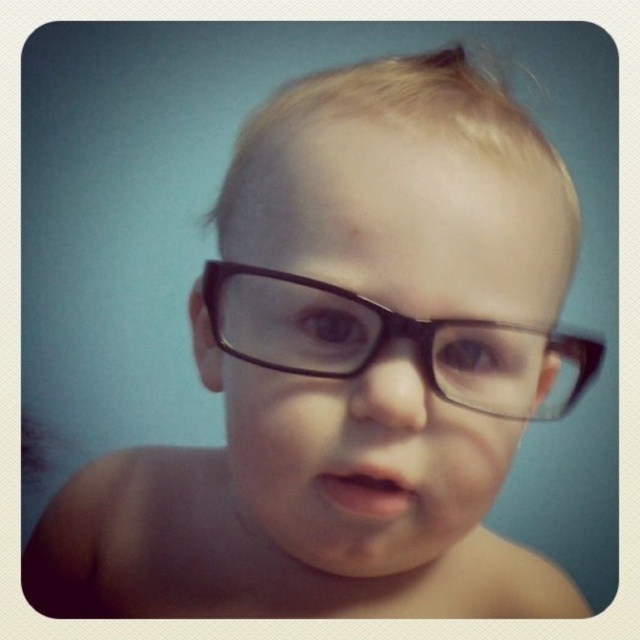
The child in the image is wearing two pairs of glasses, the black matte glasses at center and the black plastic glasses at center. Which pair is taller?

The black matte glasses at center is taller than black plastic glasses at center.